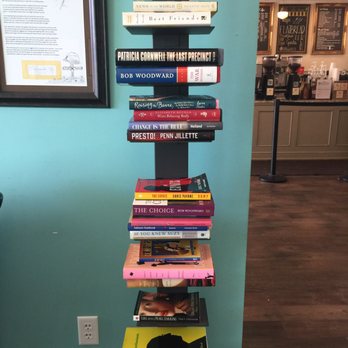
In order to click on shelves in this screenshot , I will do `click(190, 29)`, `click(175, 85)`, `click(178, 142)`, `click(173, 239)`, `click(175, 290)`, `click(203, 324)`.